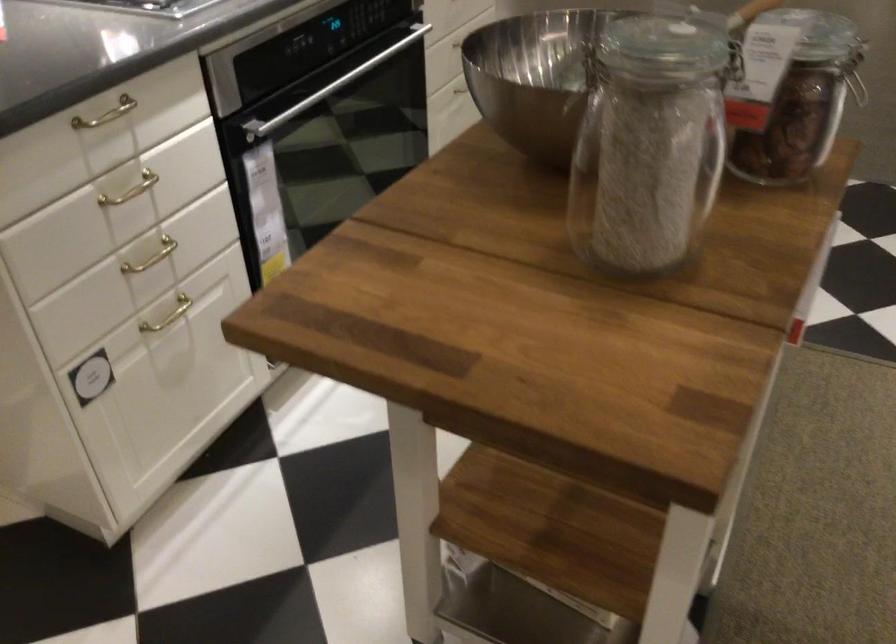
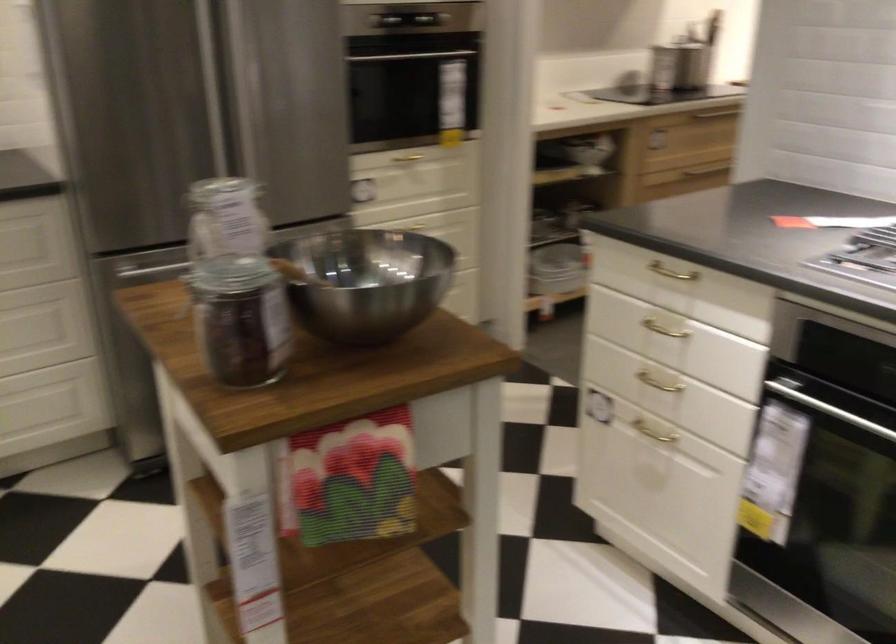
Locate, in the second image, the point that corresponds to point 173,245 in the first image.

(659, 383)